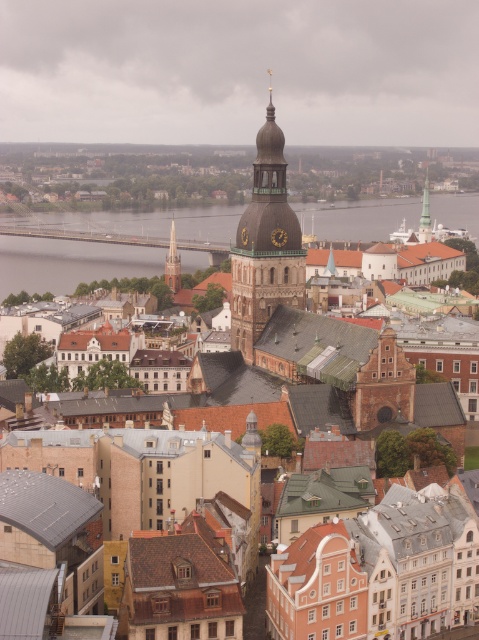
Question: Does matte brown tower at center have a larger size compared to gold textured clock tower at center?

Choices:
 (A) no
 (B) yes

Answer: (B)

Question: Among these points, which one is nearest to the camera?

Choices:
 (A) (418, 236)
 (B) (171, 291)

Answer: (B)

Question: Does smooth concrete bridge at center have a smaller size compared to smooth silver spire at center?

Choices:
 (A) yes
 (B) no

Answer: (B)

Question: Which point is farther from the camera taking this photo?

Choices:
 (A) (264, 244)
 (B) (171, 262)
 (C) (92, 273)

Answer: (C)

Question: Among these points, which one is nearest to the camera?

Choices:
 (A) [178, 285]
 (B) [259, 333]

Answer: (B)

Question: Can you confirm if gold textured clock tower at center is positioned to the left of green copper spire at upper center?

Choices:
 (A) yes
 (B) no

Answer: (A)